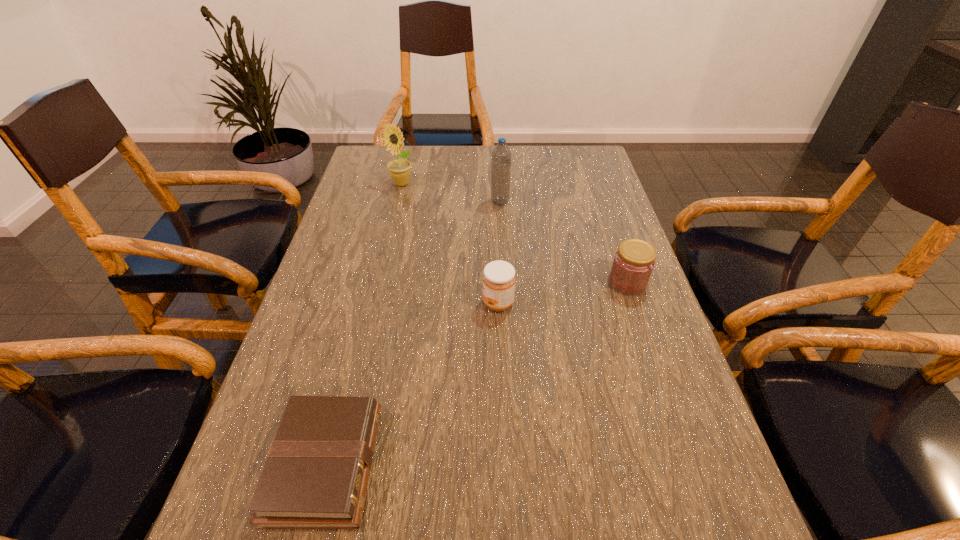
Where is `sunflower`? Image resolution: width=960 pixels, height=540 pixels. sunflower is located at coordinates (399, 170).

I want to click on water bottle, so click(x=501, y=156).

Find the location of a particular element. The height and width of the screenshot is (540, 960). the right jam is located at coordinates (633, 263).

Find the location of a particular element. Image resolution: width=960 pixels, height=540 pixels. the left jam is located at coordinates (499, 278).

You are a GUI agent. You are given a task and a screenshot of the screen. Output one action in this format:
    pyautogui.click(x=<x>, y=<y>)
    Task: Click on the Bible
    The image size is (960, 540).
    Given the screenshot: What is the action you would take?
    pyautogui.click(x=316, y=474)

This screenshot has width=960, height=540. Identify the location of the shortest object. (316, 474).

Locate an element on the screen. This screenshot has width=960, height=540. free space located 0.290m on the face of the sunflower is located at coordinates (385, 253).

You are a GUI agent. You are given a task and a screenshot of the screen. Output one action in this format:
    pyautogui.click(x=<x>, y=<y>)
    Task: Click on the vacant space located 0.230m on the back of the fourth nearest object
    
    Given the screenshot: What is the action you would take?
    pyautogui.click(x=497, y=158)

Identify the location of free location located 0.070m on the front of the right jam. (640, 320).

I want to click on blank space located 0.170m on the front label of the left jam, so coord(408,303).